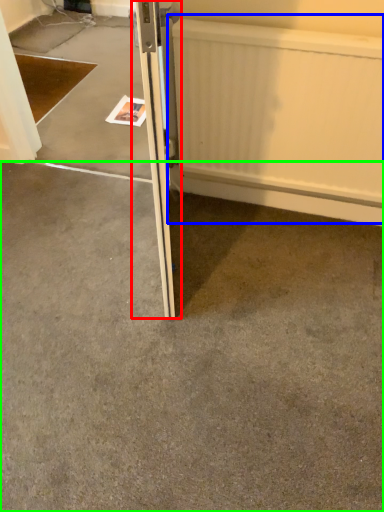
Question: Estimate the real-world distances between objects in this image. Which object is closer to door (highlighted by a red box), radiator (highlighted by a blue box) or concrete (highlighted by a green box)?

Choices:
 (A) radiator
 (B) concrete

Answer: (A)